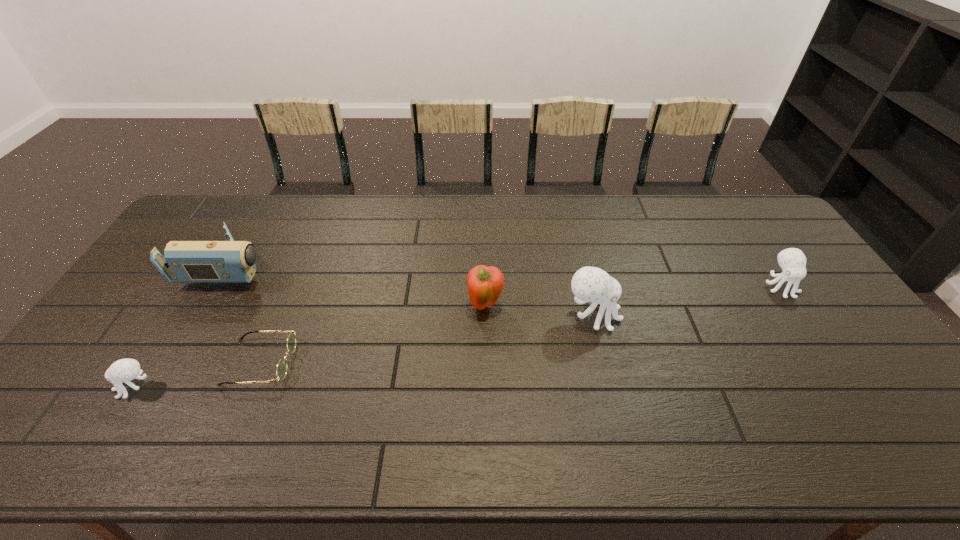
Identify the location of the leftmost octopus. The height and width of the screenshot is (540, 960). (124, 370).

Find the location of `the nearest octopus`. the nearest octopus is located at coordinates (124, 370).

Image resolution: width=960 pixels, height=540 pixels. I want to click on the tallest octopus, so click(589, 284).

I want to click on the fifth object from left to right, so click(589, 284).

At what (x,y) coordinates should I click in order to perform the action: click on the fourth tallest object. Please return your answer as a coordinate pair (x, y). Looking at the image, I should click on (792, 261).

What are the coordinates of `the rightmost octopus` in the screenshot? It's located at (792, 261).

Where is `camcorder`? The width and height of the screenshot is (960, 540). camcorder is located at coordinates (231, 261).

Where is `spectacles`? This screenshot has width=960, height=540. spectacles is located at coordinates (281, 370).

Identify the location of the third object from right to left. (485, 284).

Where is `free location located 0.120m on the front-facing side of the leftmost octopus`? The image size is (960, 540). free location located 0.120m on the front-facing side of the leftmost octopus is located at coordinates (68, 387).